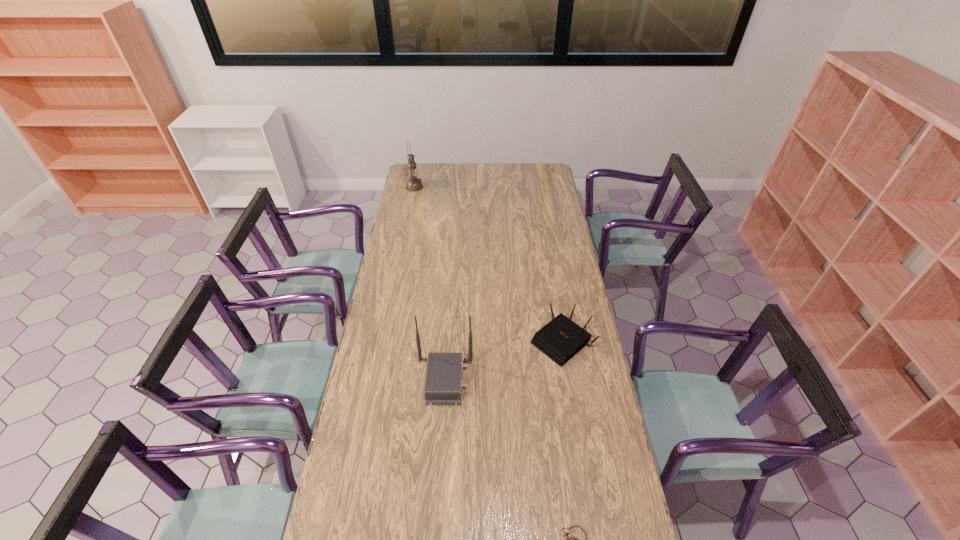
Where is `free space that is in between the left router and the shorter router`? The height and width of the screenshot is (540, 960). free space that is in between the left router and the shorter router is located at coordinates (503, 361).

Identify the location of free space between the third shortest object and the shorter router. (503, 361).

Image resolution: width=960 pixels, height=540 pixels. In order to click on object that stands as the closest to the shorter router in this screenshot , I will do `click(443, 385)`.

You are a GUI agent. You are given a task and a screenshot of the screen. Output one action in this format:
    pyautogui.click(x=<x>, y=<y>)
    Task: Click on the object that is the third closest one to the second object from left to right
    
    Given the screenshot: What is the action you would take?
    pyautogui.click(x=413, y=184)